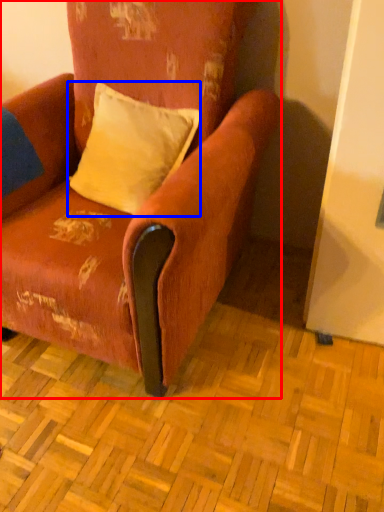
Question: Which object appears closest to the camera in this image, chair (highlighted by a red box) or pillow (highlighted by a blue box)?

Choices:
 (A) chair
 (B) pillow

Answer: (A)